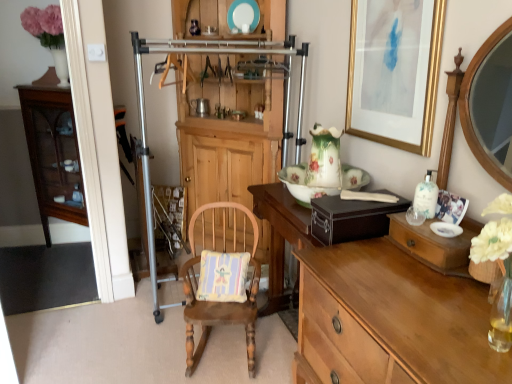
Question: From a real-world perspective, is floral porcelain plate at center, placed as the first plate when sorted from bottom to top, beneath pastel striped fabric pillow at center?

Choices:
 (A) no
 (B) yes

Answer: (A)

Question: Does floral porcelain plate at center, which ranks as the first plate in right-to-left order, have a lesser width compared to pastel striped fabric pillow at center?

Choices:
 (A) no
 (B) yes

Answer: (A)

Question: Does floral porcelain plate at center, acting as the 2th plate starting from the top, come in front of pastel striped fabric pillow at center?

Choices:
 (A) no
 (B) yes

Answer: (B)

Question: From the image's perspective, is floral porcelain plate at center, placed as the first plate when sorted from bottom to top, under pastel striped fabric pillow at center?

Choices:
 (A) no
 (B) yes

Answer: (A)

Question: Considering the relative sizes of floral porcelain plate at center, arranged as the 1th plate when viewed from the front, and pastel striped fabric pillow at center in the image provided, is floral porcelain plate at center, arranged as the 1th plate when viewed from the front, smaller than pastel striped fabric pillow at center?

Choices:
 (A) yes
 (B) no

Answer: (B)

Question: Does floral porcelain plate at center, placed as the 2th plate when sorted from back to front, turn towards pastel striped fabric pillow at center?

Choices:
 (A) no
 (B) yes

Answer: (A)

Question: From a real-world perspective, is wooden rocking chair with cushion at center beneath gold-framed artwork at upper right?

Choices:
 (A) no
 (B) yes

Answer: (B)

Question: Is wooden rocking chair with cushion at center turned away from gold-framed artwork at upper right?

Choices:
 (A) no
 (B) yes

Answer: (A)

Question: Does wooden rocking chair with cushion at center have a greater height compared to gold-framed artwork at upper right?

Choices:
 (A) yes
 (B) no

Answer: (A)

Question: Could you tell me if wooden rocking chair with cushion at center is facing gold-framed artwork at upper right?

Choices:
 (A) yes
 (B) no

Answer: (B)

Question: Can you confirm if wooden rocking chair with cushion at center is positioned to the left of gold-framed artwork at upper right?

Choices:
 (A) yes
 (B) no

Answer: (A)

Question: From the image's perspective, is wooden rocking chair with cushion at center beneath gold-framed artwork at upper right?

Choices:
 (A) yes
 (B) no

Answer: (A)

Question: Is the depth of metallic silver coffee cup at center less than that of light brown wood desk at center?

Choices:
 (A) yes
 (B) no

Answer: (B)